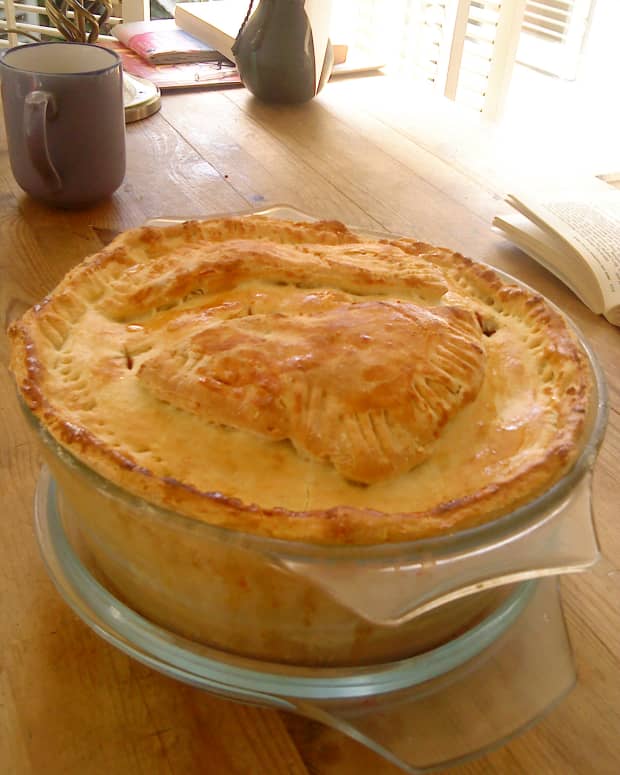
You are a GUI agent. You are given a task and a screenshot of the screen. Output one action in this format:
    pyautogui.click(x=<x>, y=<y>)
    Task: Click on the coffee cup
    
    Given the screenshot: What is the action you would take?
    [x=86, y=100]